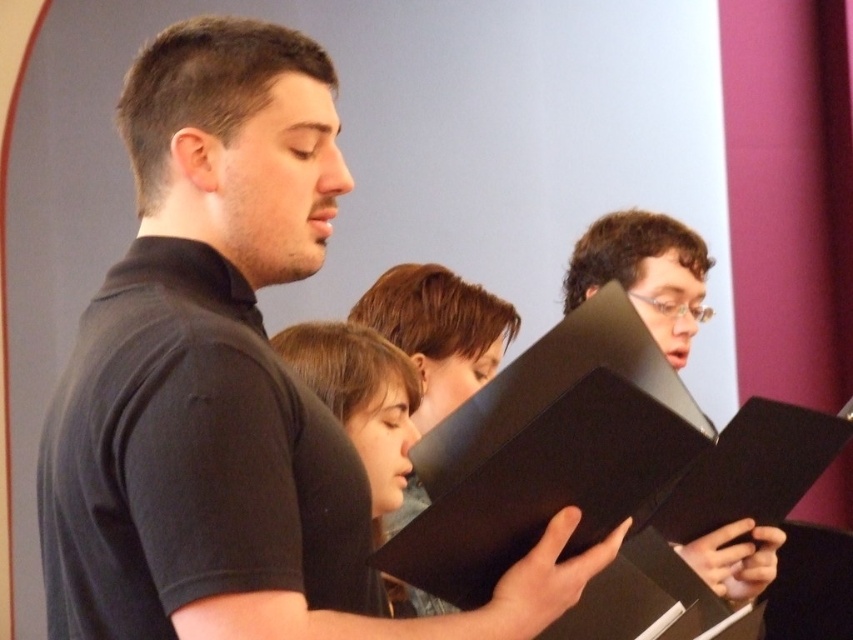
Who is positioned more to the left, black matte book at center or matte black book at center?

black matte book at center is more to the left.

Can you confirm if black matte book at center is positioned to the right of matte black book at center?

Incorrect, black matte book at center is not on the right side of matte black book at center.

Which is behind, point (143, 381) or point (289, 355)?

The point (289, 355) is behind.

You are a GUI agent. You are given a task and a screenshot of the screen. Output one action in this format:
    pyautogui.click(x=<x>, y=<y>)
    Task: Click on the black matte book at center
    This screenshot has height=640, width=853.
    Given the screenshot: What is the action you would take?
    pyautogui.click(x=228, y=384)